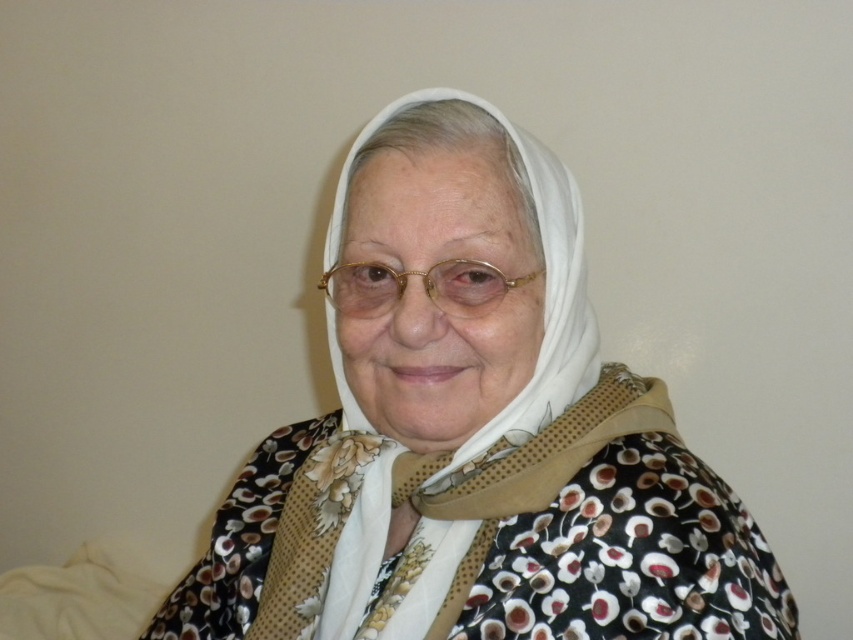
You are a photographer adjusting the lighting for a portrait. You need to ensure that the white fabric headscarf at center and gold metallic glasses at center are both well lit. Which object should you focus the light on first to account for their size difference?

The white fabric headscarf at center is much taller than the gold metallic glasses at center, so you should focus the light on the white fabric headscarf at center first to ensure its larger surface is properly illuminated.

You are a photographer standing at the camera position. You want to take a photo of the elderly person. The camera is 25.73 inches away from the point at coordinates point (492, 236). Is the distance sufficient to capture the entire elderly person in the frame?

The camera is 25.73 inches away from the point at coordinates point (492, 236). However, without knowing the camera sensor size and focal length, it is impossible to determine if the distance is sufficient to capture the entire elderly person in the frame.